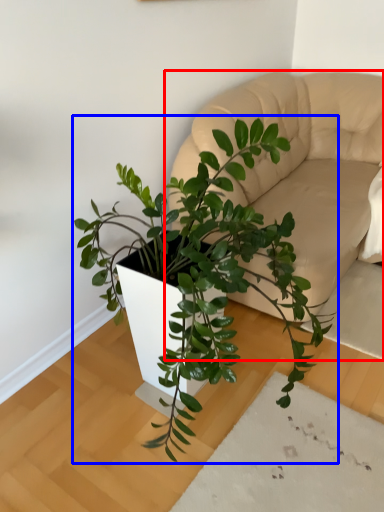
Question: Among these objects, which one is nearest to the camera, couch (highlighted by a red box) or houseplant (highlighted by a blue box)?

Choices:
 (A) couch
 (B) houseplant

Answer: (B)